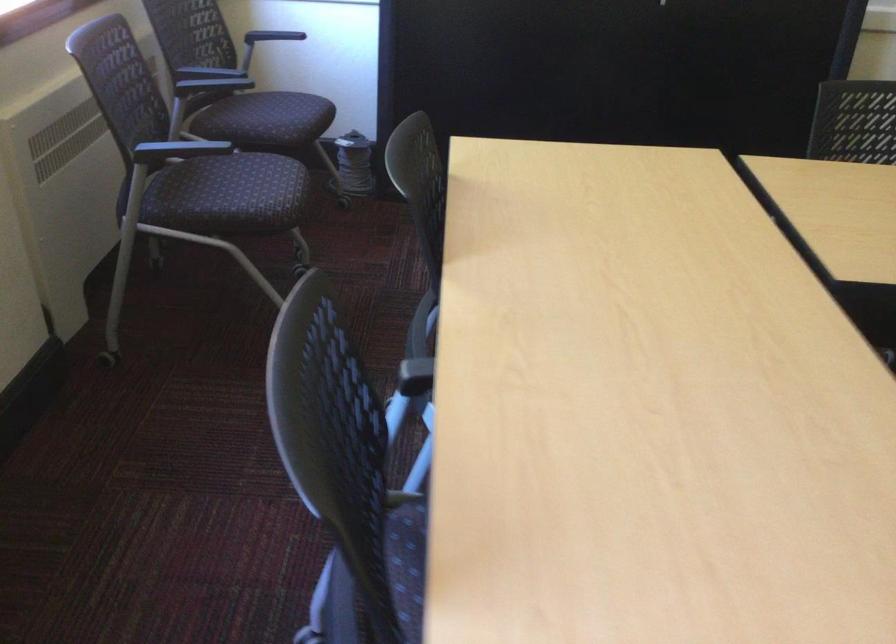
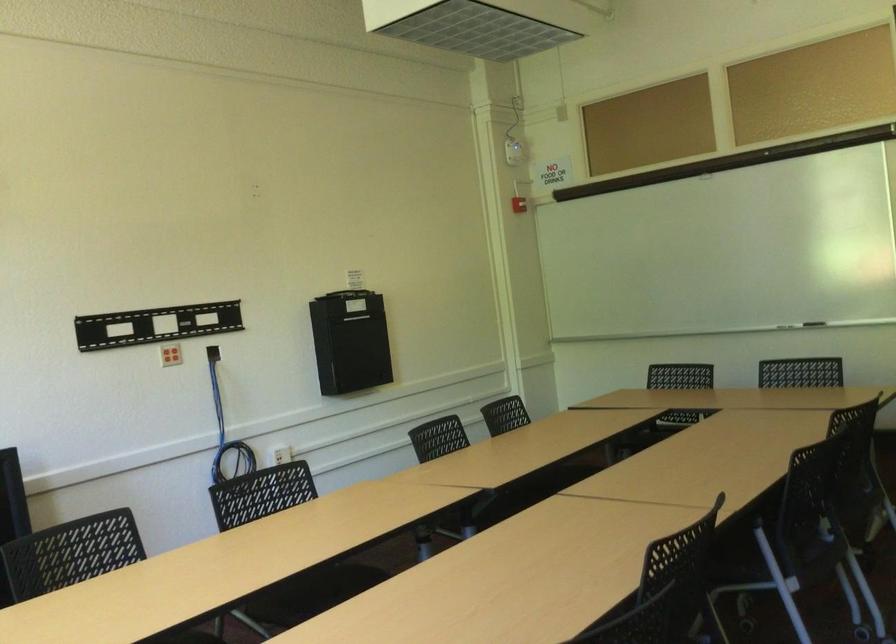
Question: How did the camera likely rotate?

Choices:
 (A) Left
 (B) Right
 (C) Up
 (D) Down

Answer: (B)